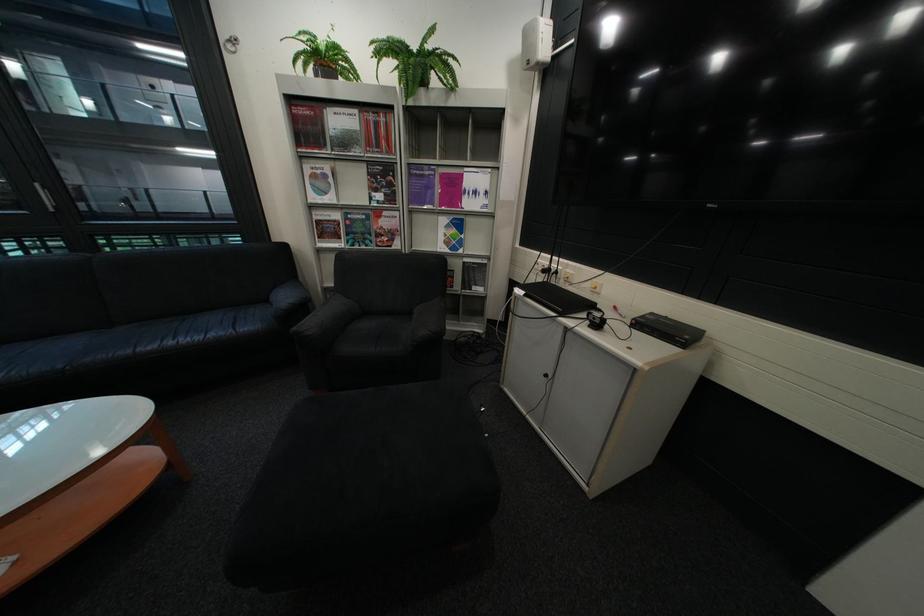
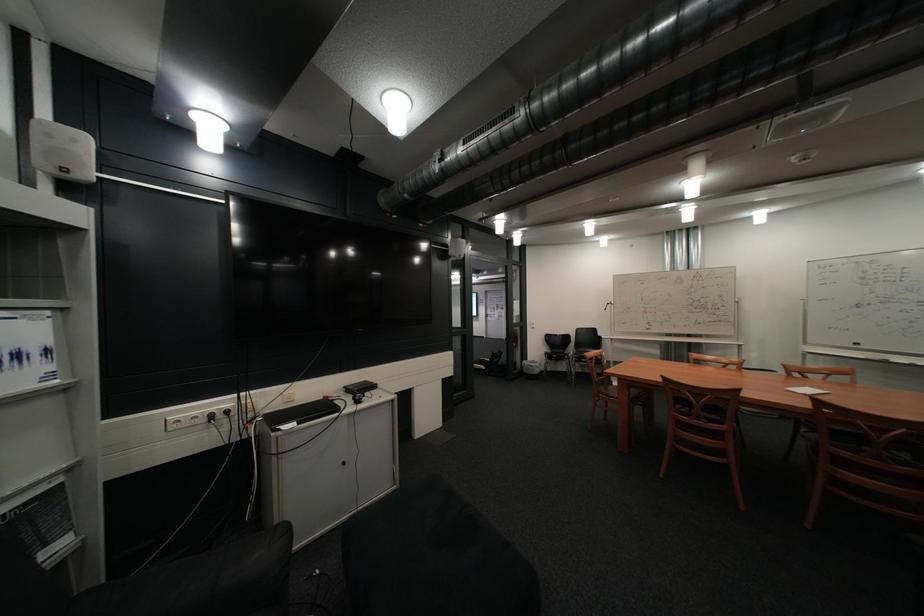
Find the pixel in the second image that matches (x=481, y=260) in the first image.

(10, 514)